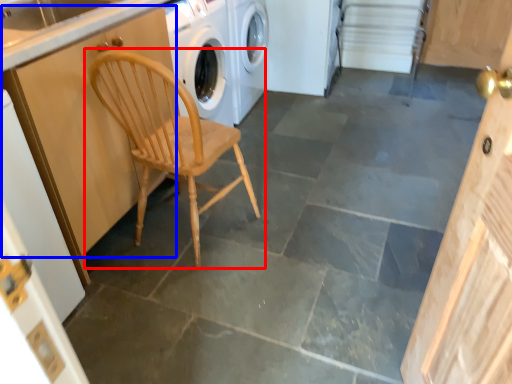
Question: Which object is closer to the camera taking this photo, chair (highlighted by a red box) or cabinetry (highlighted by a blue box)?

Choices:
 (A) chair
 (B) cabinetry

Answer: (B)